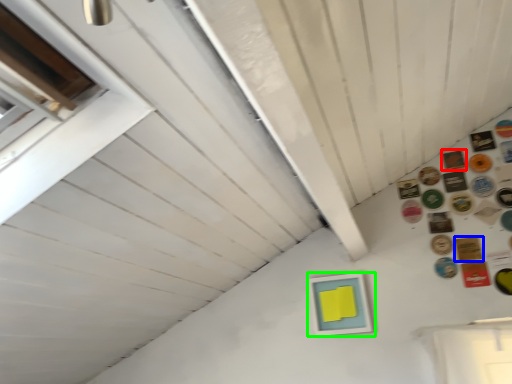
Question: Which object is the closest to the button (highlighted by a red box)? Choose among these: button (highlighted by a blue box) or picture frame (highlighted by a green box).

Choices:
 (A) button
 (B) picture frame

Answer: (A)